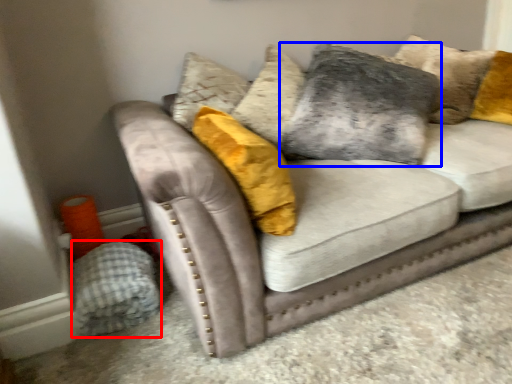
Question: Among these objects, which one is nearest to the camera, material (highlighted by a red box) or pillow (highlighted by a blue box)?

Choices:
 (A) material
 (B) pillow

Answer: (A)